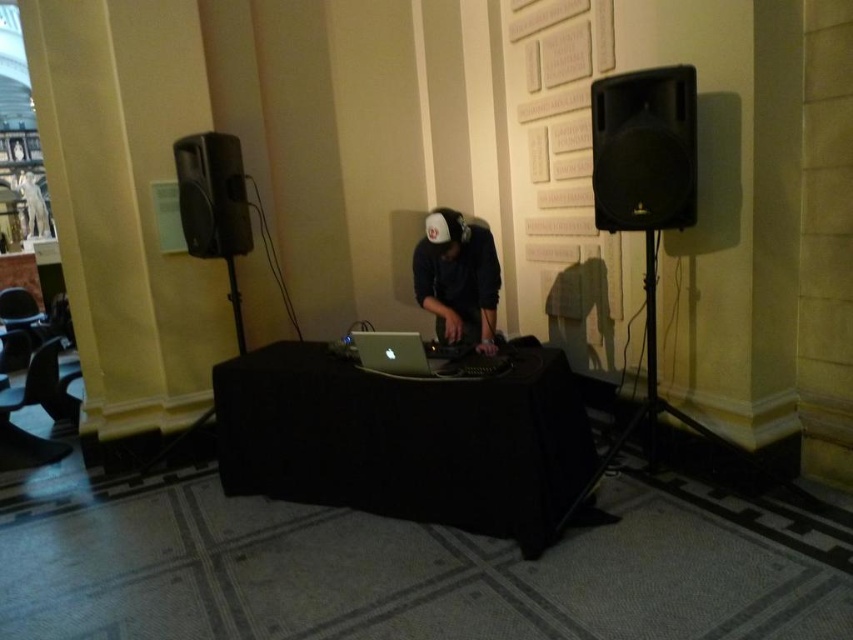
You are a guest at an event and want to ask the DJ a question. You are standing near the black matte speaker at right. Which direction should you move to reach the DJ who is at the black fabric table at center?

The black fabric table at center is in front of the black matte speaker at right, so you should move forward towards the black fabric table at center to reach the DJ.

You are standing in the DJ setup area and need to determine which of the two points, point (529, 506) or point (431, 369), is closer to you. Based on the scene description, which point is nearer?

Point (529, 506) is closer to the viewer than point (431, 369) according to the description.